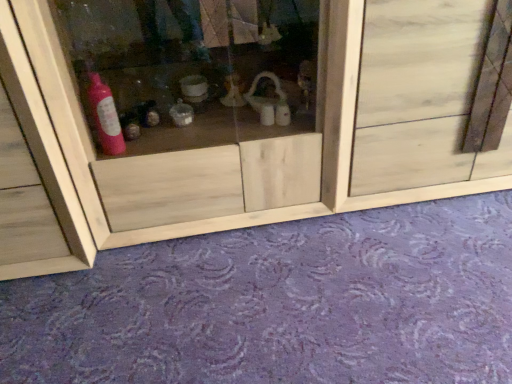
Question: From a real-world perspective, is transparent wood cabinet at center located higher than purple carpet at lower center?

Choices:
 (A) no
 (B) yes

Answer: (B)

Question: Does transparent wood cabinet at center have a lesser height compared to purple carpet at lower center?

Choices:
 (A) no
 (B) yes

Answer: (A)

Question: From a real-world perspective, is transparent wood cabinet at center below purple carpet at lower center?

Choices:
 (A) no
 (B) yes

Answer: (A)

Question: Can you confirm if transparent wood cabinet at center is positioned to the left of purple carpet at lower center?

Choices:
 (A) no
 (B) yes

Answer: (B)

Question: Is transparent wood cabinet at center to the right of purple carpet at lower center from the viewer's perspective?

Choices:
 (A) yes
 (B) no

Answer: (B)

Question: Considering the positions of purple carpet at lower center and transparent wood cabinet at center in the image, is purple carpet at lower center wider or thinner than transparent wood cabinet at center?

Choices:
 (A) thin
 (B) wide

Answer: (B)

Question: In terms of height, does purple carpet at lower center look taller or shorter compared to transparent wood cabinet at center?

Choices:
 (A) short
 (B) tall

Answer: (A)

Question: Is point (186, 337) closer or farther from the camera than point (208, 52)?

Choices:
 (A) closer
 (B) farther

Answer: (A)

Question: Is purple carpet at lower center bigger or smaller than transparent wood cabinet at center?

Choices:
 (A) small
 (B) big

Answer: (A)

Question: In the image, is transparent wood cabinet at center positioned in front of or behind natural wood door at center?

Choices:
 (A) behind
 (B) front

Answer: (B)

Question: From the image's perspective, relative to natural wood door at center, is transparent wood cabinet at center above or below?

Choices:
 (A) below
 (B) above

Answer: (A)

Question: Is transparent wood cabinet at center inside the boundaries of natural wood door at center, or outside?

Choices:
 (A) inside
 (B) outside

Answer: (B)

Question: Considering the relative positions of transparent wood cabinet at center and natural wood door at center in the image provided, is transparent wood cabinet at center to the left or to the right of natural wood door at center?

Choices:
 (A) left
 (B) right

Answer: (A)

Question: Considering the positions of point (431, 306) and point (507, 122), is point (431, 306) closer or farther from the camera than point (507, 122)?

Choices:
 (A) closer
 (B) farther

Answer: (A)

Question: From a real-world perspective, is purple carpet at lower center above or below natural wood door at center?

Choices:
 (A) above
 (B) below

Answer: (B)